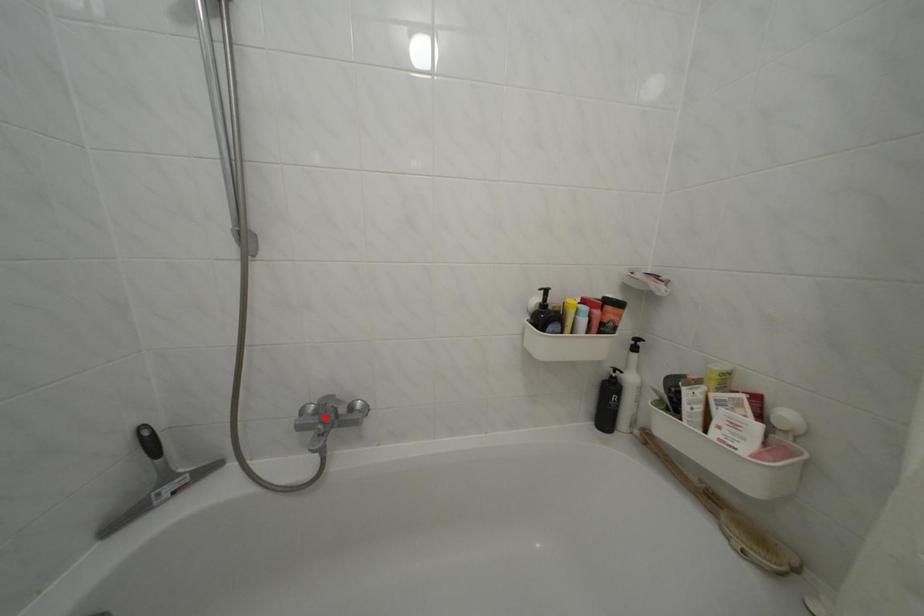
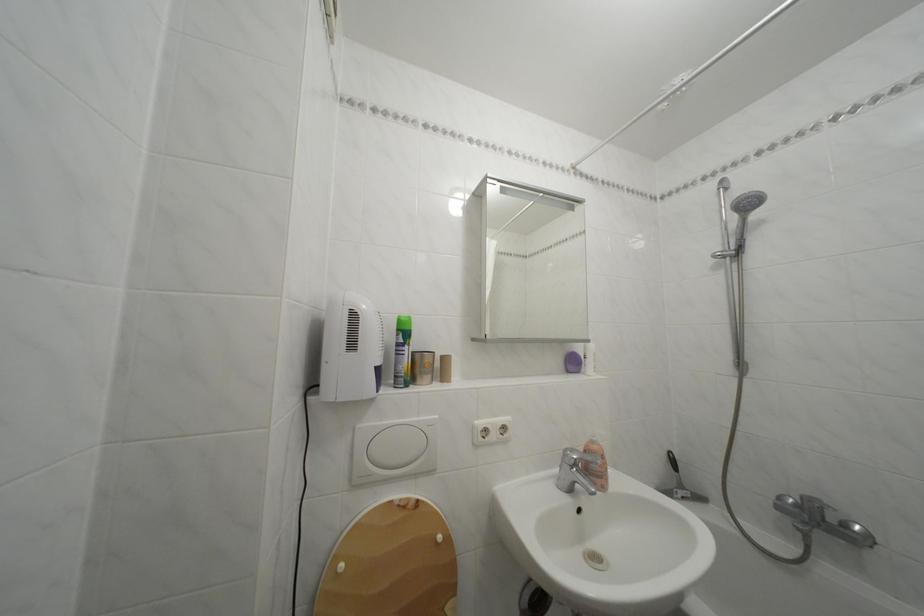
The point at the highlighted location is marked in the first image. Where is the corresponding point in the second image?

(806, 512)